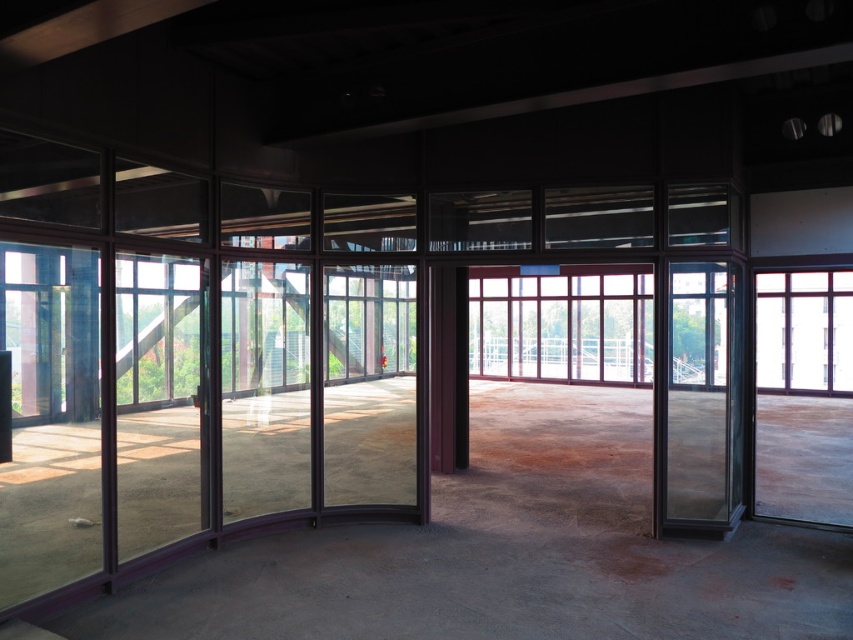
Question: Which of the following is the farthest from the observer?

Choices:
 (A) clear glass window at center
 (B) transparent glass door at right
 (C) clear glass window at right

Answer: (A)

Question: Can you confirm if transparent glass door at right is thinner than clear glass window at right?

Choices:
 (A) yes
 (B) no

Answer: (A)

Question: Among these objects, which one is farthest from the camera?

Choices:
 (A) clear glass window at right
 (B) clear glass window at center

Answer: (B)

Question: Can you confirm if transparent glass door at right is wider than clear glass window at right?

Choices:
 (A) no
 (B) yes

Answer: (A)

Question: Which of the following is the farthest from the observer?

Choices:
 (A) transparent glass door at right
 (B) clear glass window at right
 (C) clear glass window at center

Answer: (C)

Question: Is clear glass window at center smaller than clear glass window at right?

Choices:
 (A) no
 (B) yes

Answer: (B)